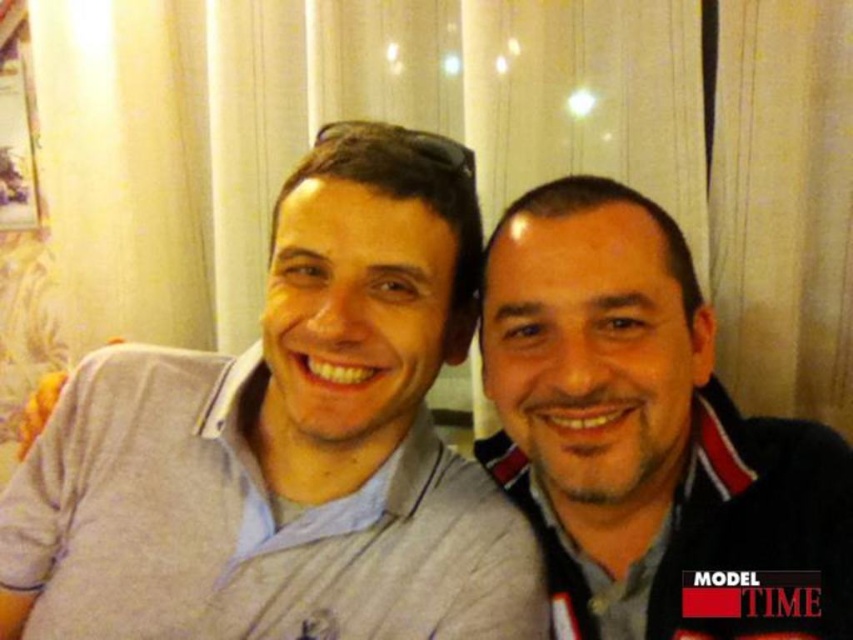
Does gray cotton shirt at left have a greater height compared to matte black jacket at right?

A: Yes.

How far apart are gray cotton shirt at left and matte black jacket at right?

15.36 centimeters

Which is in front, point (363, 552) or point (664, 465)?

Positioned in front is point (664, 465).

Where is `gray cotton shirt at left`? gray cotton shirt at left is located at coordinates (287, 442).